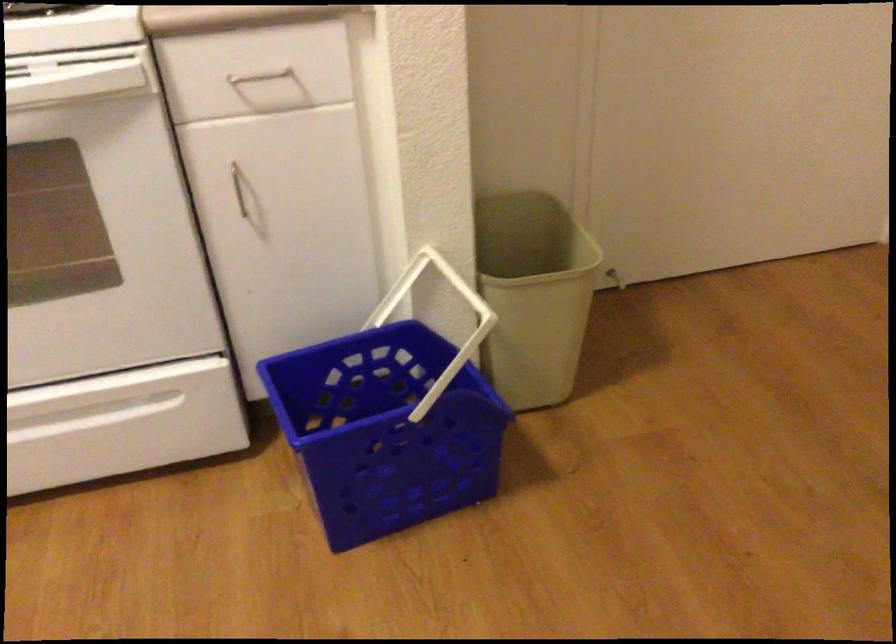
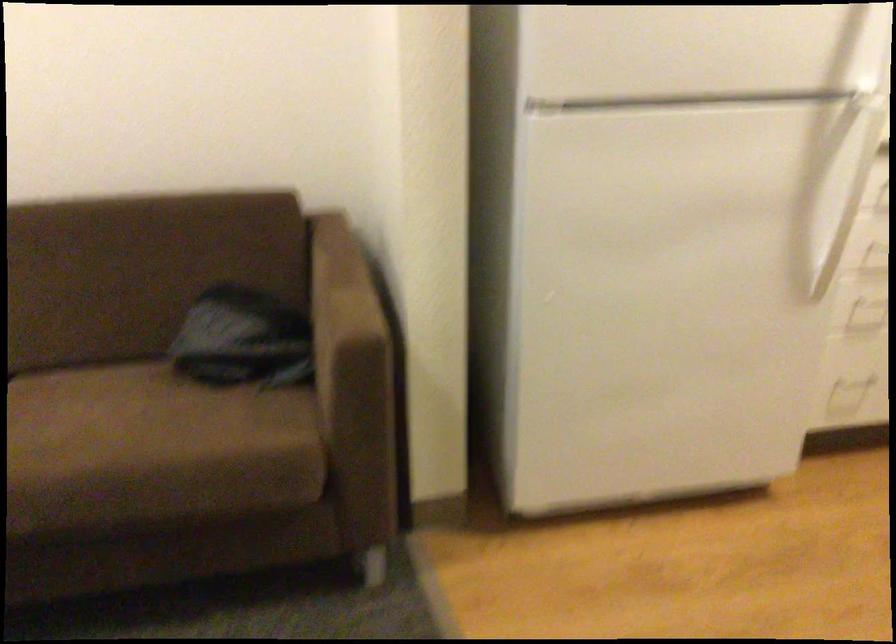
First-person continuous shooting, in which direction is the camera rotating?

The rotation direction of the camera is left-down.